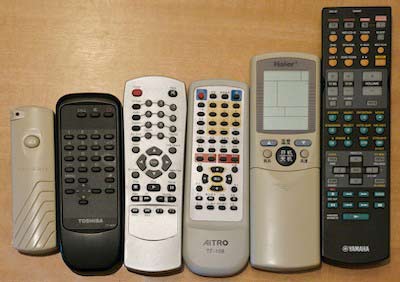
You are a GUI agent. You are given a task and a screenshot of the screen. Output one action in this format:
    pyautogui.click(x=<x>, y=<y>)
    Task: Click on the vcr
    The image size is (400, 282).
    Given the screenshot: What is the action you would take?
    pyautogui.click(x=278, y=222), pyautogui.click(x=221, y=223)